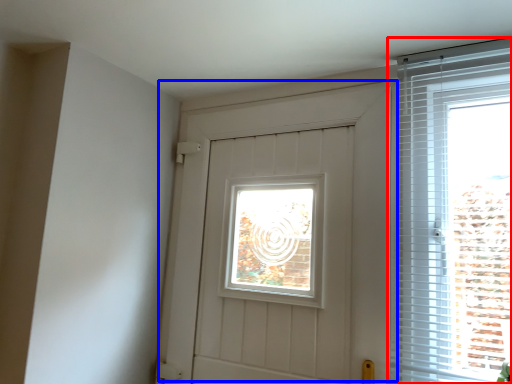
Question: Among these objects, which one is farthest to the camera, window (highlighted by a red box) or door (highlighted by a blue box)?

Choices:
 (A) window
 (B) door

Answer: (B)